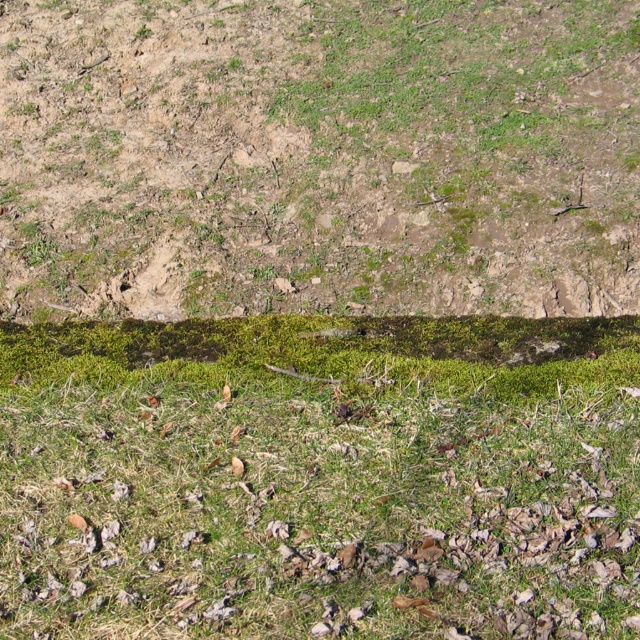
Question: Can you confirm if green grassy at lower center is positioned above green mossy soil at center?

Choices:
 (A) yes
 (B) no

Answer: (B)

Question: Can you confirm if green grassy at lower center is positioned to the left of green mossy soil at center?

Choices:
 (A) yes
 (B) no

Answer: (B)

Question: Which point is closer to the camera taking this photo?

Choices:
 (A) (67, 608)
 (B) (90, 122)

Answer: (A)

Question: Can you confirm if green grassy at lower center is thinner than green mossy soil at center?

Choices:
 (A) no
 (B) yes

Answer: (B)